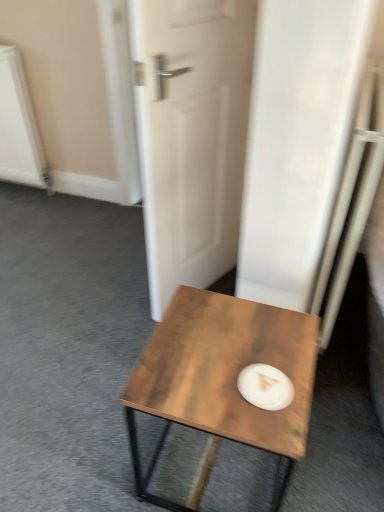
I want to click on unoccupied space behind white matte paper plate at center, so (251, 335).